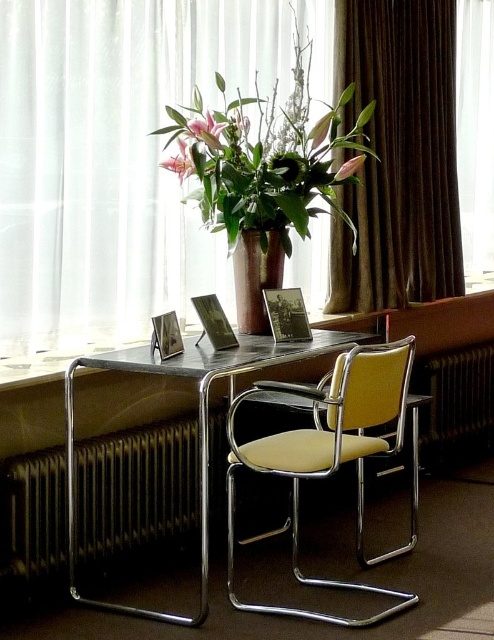
Question: Which object is the farthest from the brown velvet curtain at right?

Choices:
 (A) metallic desk at center
 (B) matte pink lily at center

Answer: (B)

Question: Can you confirm if matte brown vase at center is smaller than beige leather swivel chair at center?

Choices:
 (A) no
 (B) yes

Answer: (A)

Question: Observing the image, what is the correct spatial positioning of matte brown vase at center in reference to pink matte flower at center?

Choices:
 (A) right
 (B) left

Answer: (B)

Question: Based on their relative distances, which object is nearer to the beige leather swivel chair at center?

Choices:
 (A) pink matte flower at upper center
 (B) matte brown vase at center

Answer: (B)

Question: Which of the following is the closest to the observer?

Choices:
 (A) (90, 368)
 (B) (486, 60)
 (C) (227, 180)

Answer: (A)

Question: Can you confirm if brown ceramic vase at center is positioned above matte pink lily at center?

Choices:
 (A) no
 (B) yes

Answer: (A)